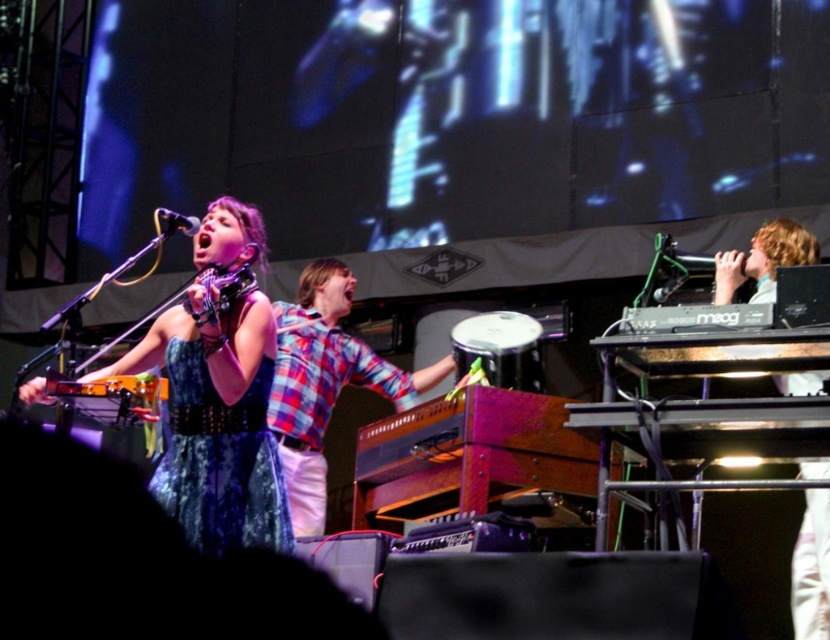
Based on the scene description, can you identify the object located at the coordinates point (217, 422)?

The point (217, 422) marks the denim dress at left.

You are a photographer at the concert. You want to take a photo of the denim dress at left and the light brown wooden keyboard at right. Which object is closer to you?

The denim dress at left is closer to the viewer than the light brown wooden keyboard at right.